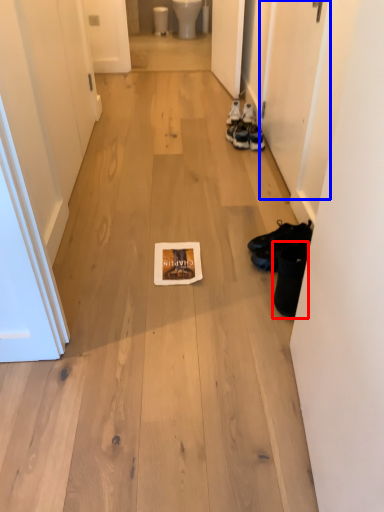
Question: Which object is closer to the camera taking this photo, footwear (highlighted by a red box) or door (highlighted by a blue box)?

Choices:
 (A) footwear
 (B) door

Answer: (A)